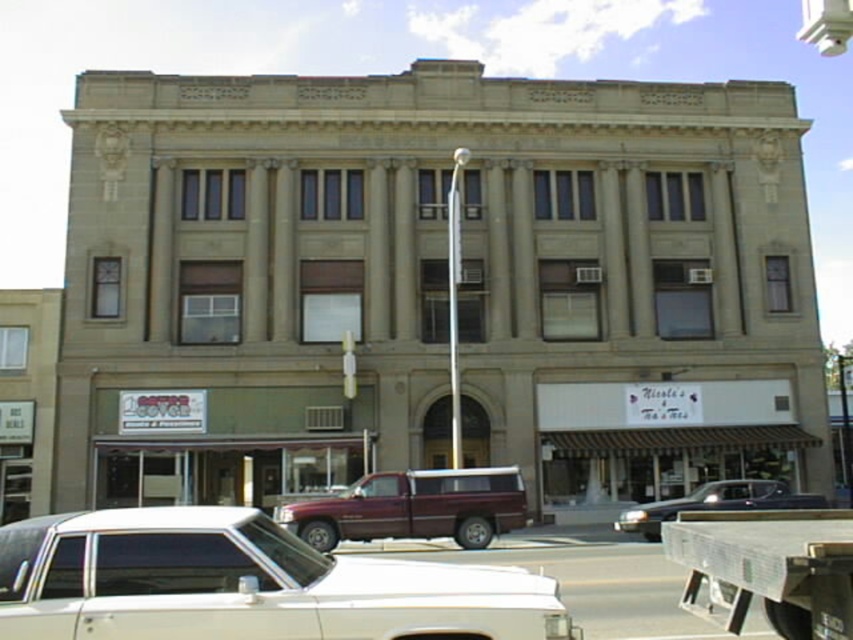
You are a pedestrian standing on the sidewalk in front of the building. You see the white glossy car at center and the metallic silver truck bed at lower right. Which vehicle is closer to the building?

The white glossy car at center is closer to the building because it is positioned to the left of the metallic silver truck bed at lower right, which is further away from the building.